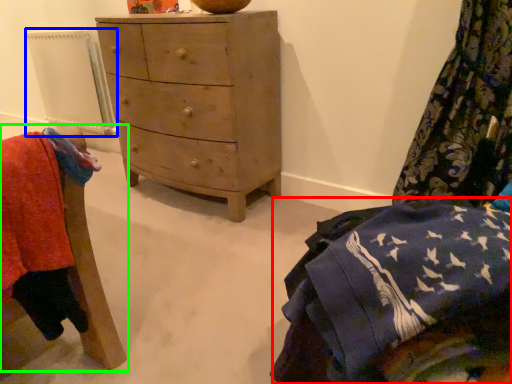
Question: Which is nearer to the clothing (highlighted by a red box)? radiator (highlighted by a blue box) or furniture (highlighted by a green box).

Choices:
 (A) radiator
 (B) furniture

Answer: (B)